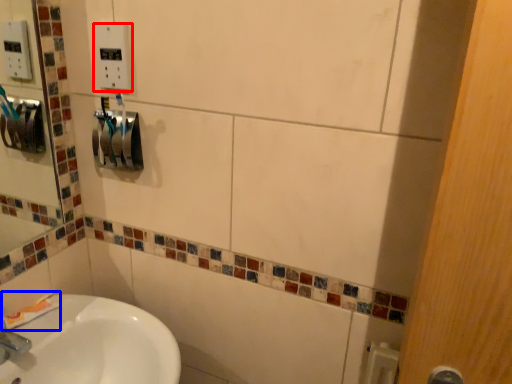
Question: Which point is closer to the camera, electric outlet (highlighted by a red box) or toothpaste (highlighted by a blue box)?

Choices:
 (A) electric outlet
 (B) toothpaste

Answer: (A)